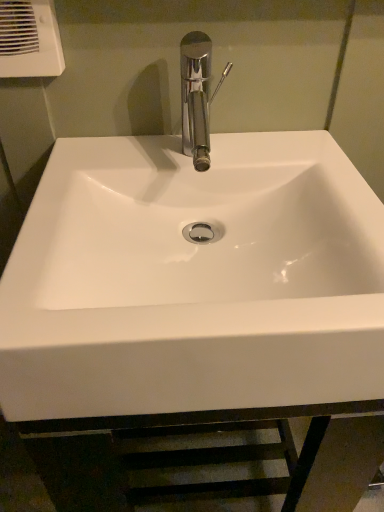
This screenshot has width=384, height=512. Describe the element at coordinates (29, 39) in the screenshot. I see `white plastic hand dryer at upper left` at that location.

Where is `white plastic hand dryer at upper left`? The height and width of the screenshot is (512, 384). white plastic hand dryer at upper left is located at coordinates (29, 39).

Locate an element on the screen. white plastic hand dryer at upper left is located at coordinates (29, 39).